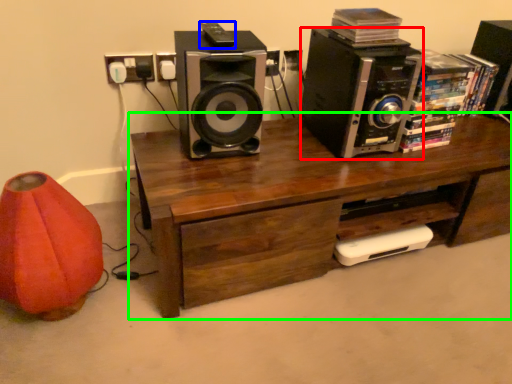
Question: Which is farther away from speaker (highlighted by a red box)? ipod (highlighted by a blue box) or desk (highlighted by a green box)?

Choices:
 (A) ipod
 (B) desk

Answer: (A)